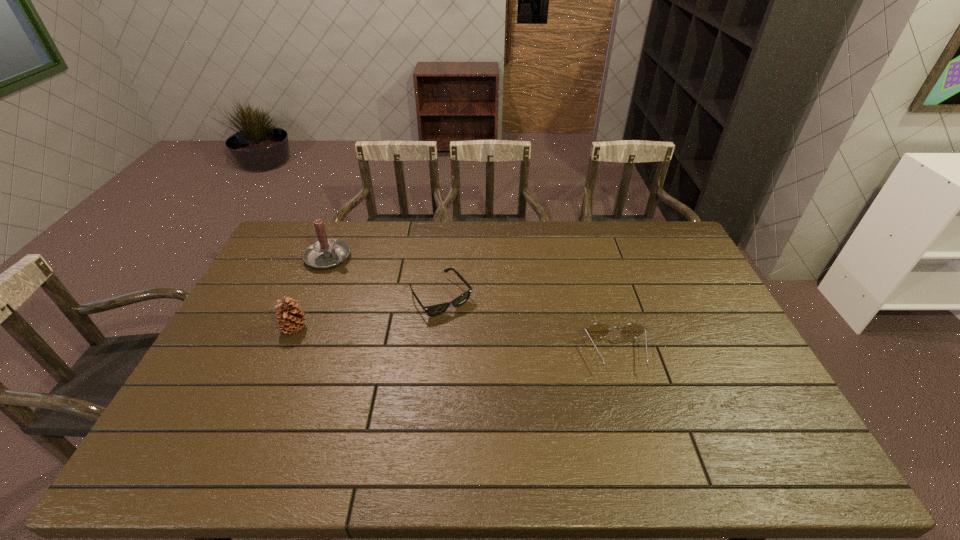
You are a GUI agent. You are given a task and a screenshot of the screen. Output one action in this format:
    pyautogui.click(x=<x>, y=<y>)
    Task: Click on the pinecone
    
    Given the screenshot: What is the action you would take?
    pyautogui.click(x=291, y=319)

This screenshot has height=540, width=960. In order to click on the rightmost object in this screenshot , I will do `click(598, 330)`.

Identify the location of the farthest object. The height and width of the screenshot is (540, 960). (326, 253).

Find the location of `candle`. candle is located at coordinates (326, 253).

The height and width of the screenshot is (540, 960). Identify the location of sunglasses. (434, 310).

This screenshot has height=540, width=960. What are the coordinates of `the third object from left to right` in the screenshot? It's located at (434, 310).

Locate an element on the screen. The height and width of the screenshot is (540, 960). free space located on the back of the pinecone is located at coordinates (327, 254).

The image size is (960, 540). I want to click on free space located 0.060m on the front-facing side of the spectacles, so click(x=629, y=392).

Locate an element on the screen. The image size is (960, 540). free location located 0.300m on the side of the tallest object with the handle loop is located at coordinates (405, 303).

Image resolution: width=960 pixels, height=540 pixels. What are the coordinates of `free space located on the side of the tallest object with the handle loop` in the screenshot? It's located at (372, 284).